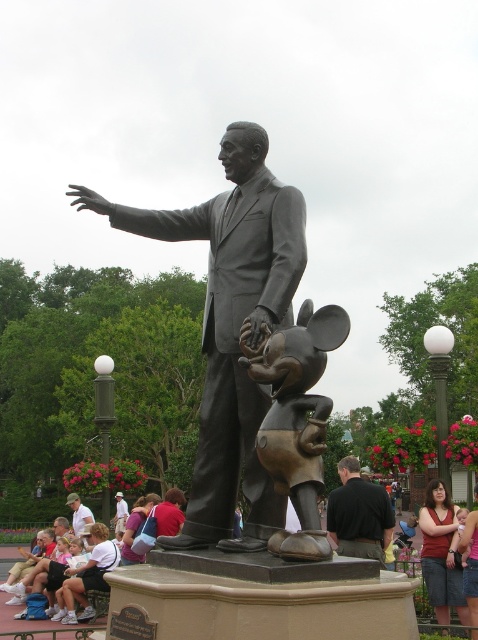
Question: Can you confirm if black matte shirt at center is thinner than matte red dress at lower right?

Choices:
 (A) yes
 (B) no

Answer: (B)

Question: Can you confirm if bronze mickey mouse at center is bigger than black matte shirt at center?

Choices:
 (A) yes
 (B) no

Answer: (B)

Question: Which point appears farthest from the camera in this image?

Choices:
 (A) (174, 500)
 (B) (303, 301)

Answer: (A)

Question: Which of these objects is positioned closest to the bronze statue at center?

Choices:
 (A) white shirt at lower left
 (B) black matte shirt at center
 (C) bronze mickey mouse at center
 (D) matte red dress at lower right

Answer: (C)

Question: Among these objects, which one is nearest to the camera?

Choices:
 (A) matte red dress at lower right
 (B) white cotton shirt at lower left

Answer: (A)

Question: From the image, what is the correct spatial relationship of white cotton shirt at lower left in relation to white shirt at lower left?

Choices:
 (A) right
 (B) left

Answer: (A)